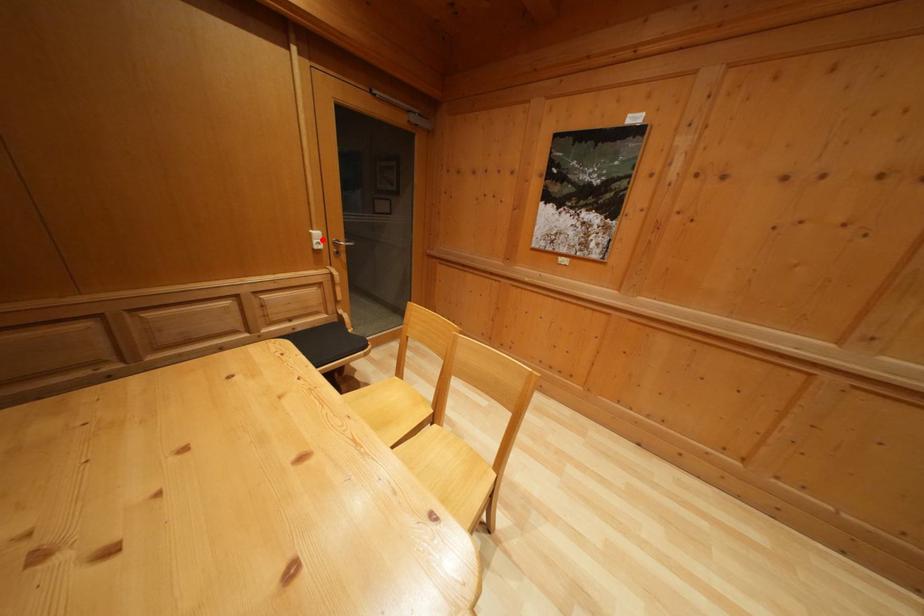
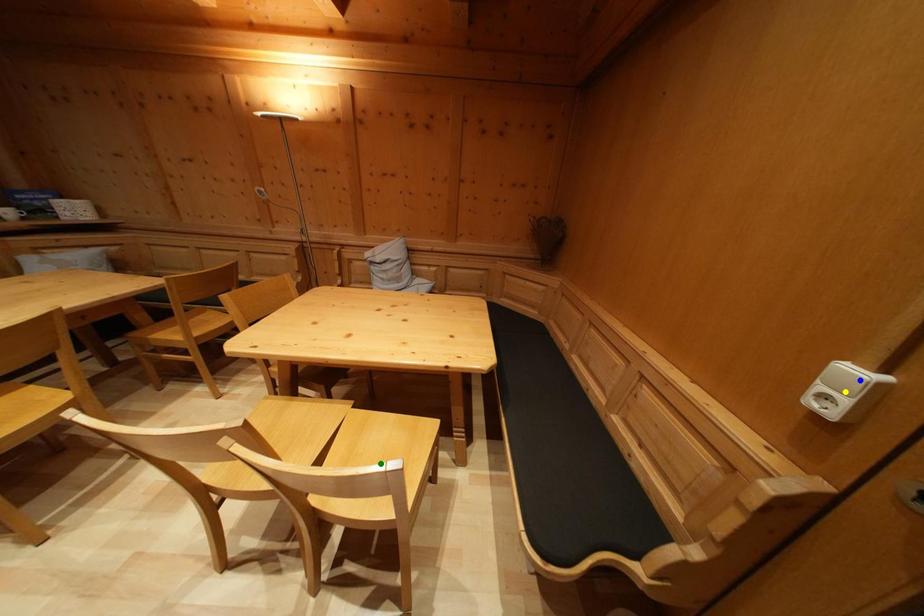
Question: I am providing you with two images of the same scene from different viewpoints. A red point is marked on the first image. You are given multiple points on the second image. Which mark in image 2 goes with the point in image 1?

Choices:
 (A) blue point
 (B) yellow point
 (C) green point

Answer: (A)